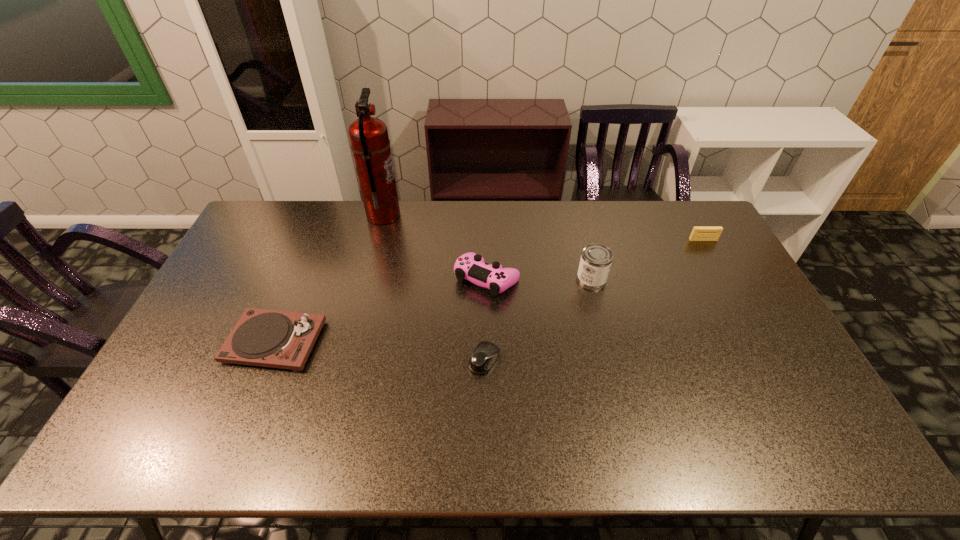
Find the location of a particular element. vacant space situated 0.250m on the right of the second tallest object is located at coordinates (684, 279).

This screenshot has height=540, width=960. Identify the location of free space located on the front of the third tallest object. (489, 421).

Find the location of a particular element. The width and height of the screenshot is (960, 540). free region located 0.330m at the front of the videotape with spools is located at coordinates (743, 313).

Where is `vacant space located 0.210m on the right of the phonograph_record`? vacant space located 0.210m on the right of the phonograph_record is located at coordinates (395, 342).

Locate an element on the screen. The width and height of the screenshot is (960, 540). vacant space situated on the left of the mouse is located at coordinates (370, 360).

Where is `fire extinguisher positioned at the far edge`? The width and height of the screenshot is (960, 540). fire extinguisher positioned at the far edge is located at coordinates (369, 141).

The height and width of the screenshot is (540, 960). I want to click on videotape that is at the far edge, so click(x=699, y=233).

This screenshot has width=960, height=540. Find the location of `object at the left edge`. object at the left edge is located at coordinates (267, 338).

The width and height of the screenshot is (960, 540). Identify the location of object at the right edge. (699, 233).

Where is `object that is at the far right corner`? The height and width of the screenshot is (540, 960). object that is at the far right corner is located at coordinates (699, 233).